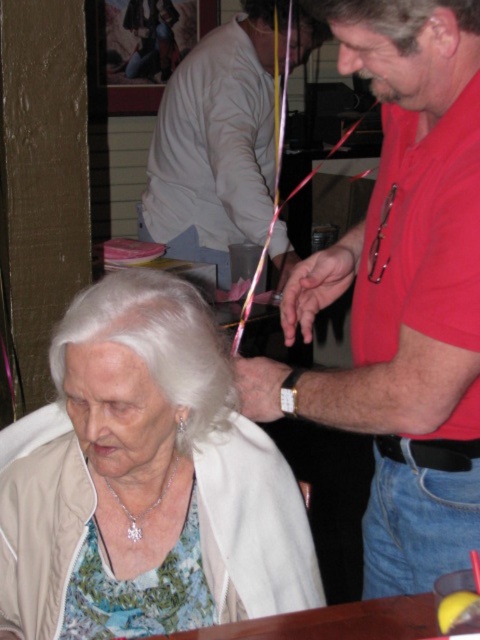
Question: Can you confirm if light beige shirt at center is positioned to the right of white silky hair at center?

Choices:
 (A) yes
 (B) no

Answer: (A)

Question: Which point is closer to the camera taking this photo?

Choices:
 (A) (223, 243)
 (B) (61, 449)
 (C) (201, 384)
 (D) (462, 198)

Answer: (D)

Question: Among these points, which one is farthest from the camera?

Choices:
 (A) (40, 525)
 (B) (408, 44)

Answer: (A)

Question: Is red shirt at right thinner than gray matte hair at upper center?

Choices:
 (A) no
 (B) yes

Answer: (A)

Question: Is red shirt at right wider than gray matte hair at upper center?

Choices:
 (A) yes
 (B) no

Answer: (A)

Question: Estimate the real-world distances between objects in this image. Which object is closer to the light beige shirt at center?

Choices:
 (A) red shirt at right
 (B) white silky hair at center
 (C) white fabric at lower left

Answer: (A)